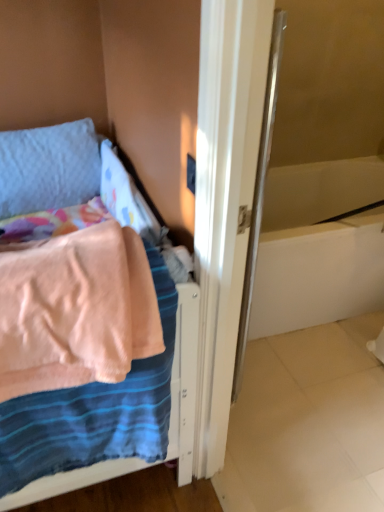
Question: Could you tell me if pink fabric bed at left is facing white glossy bathtub at center right?

Choices:
 (A) no
 (B) yes

Answer: (A)

Question: Considering the relative sizes of pink fabric bed at left and white glossy bathtub at center right in the image provided, is pink fabric bed at left taller than white glossy bathtub at center right?

Choices:
 (A) no
 (B) yes

Answer: (B)

Question: From a real-world perspective, is pink fabric bed at left over white glossy bathtub at center right?

Choices:
 (A) no
 (B) yes

Answer: (B)

Question: Does pink fabric bed at left have a greater width compared to white glossy bathtub at center right?

Choices:
 (A) yes
 (B) no

Answer: (B)

Question: Is pink fabric bed at left not close to white glossy bathtub at center right?

Choices:
 (A) yes
 (B) no

Answer: (B)

Question: Is the position of pink fabric bed at left less distant than that of white glossy bathtub at center right?

Choices:
 (A) no
 (B) yes

Answer: (B)

Question: Would you say textured blue pillow at upper left is part of white glossy bathtub at center right's contents?

Choices:
 (A) no
 (B) yes

Answer: (A)

Question: Is white glossy bathtub at center right at the right side of textured blue pillow at upper left?

Choices:
 (A) no
 (B) yes

Answer: (B)

Question: Is white glossy bathtub at center right closer to the viewer compared to textured blue pillow at upper left?

Choices:
 (A) no
 (B) yes

Answer: (A)

Question: Is white glossy bathtub at center right thinner than textured blue pillow at upper left?

Choices:
 (A) yes
 (B) no

Answer: (B)

Question: Can you confirm if white glossy bathtub at center right is wider than textured blue pillow at upper left?

Choices:
 (A) no
 (B) yes

Answer: (B)

Question: From a real-world perspective, is white glossy bathtub at center right positioned under textured blue pillow at upper left based on gravity?

Choices:
 (A) no
 (B) yes

Answer: (B)

Question: From the image's perspective, is white glossy bathtub at center right located above pink fabric bed at left?

Choices:
 (A) yes
 (B) no

Answer: (A)